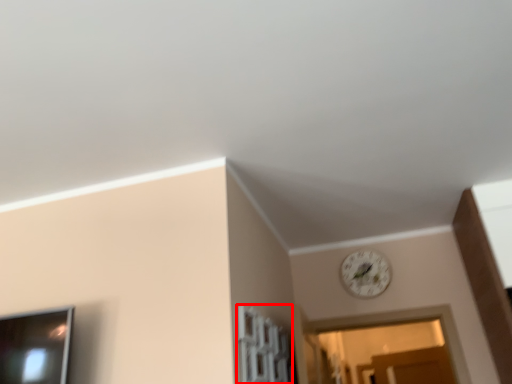
Question: Where is window (annotated by the red box) located in relation to clock in the image?

Choices:
 (A) left
 (B) right

Answer: (A)